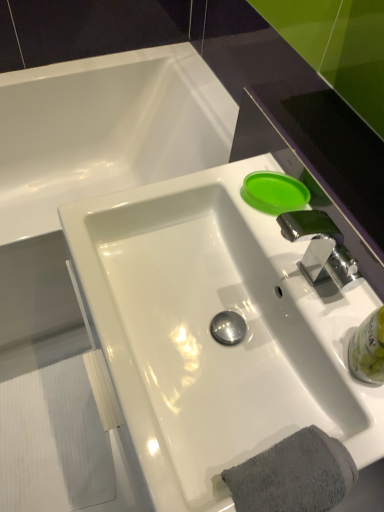
Question: In terms of height, does gray cotton towel at lower right look taller or shorter compared to clear plastic bottle at lower right, which is the second liquid in top-to-bottom order?

Choices:
 (A) short
 (B) tall

Answer: (B)

Question: In terms of size, does gray cotton towel at lower right appear bigger or smaller than clear plastic bottle at lower right, the 1th liquid positioned from the bottom?

Choices:
 (A) big
 (B) small

Answer: (A)

Question: Estimate the real-world distances between objects in this image. Which object is closer to the white glossy bathtub at upper left?

Choices:
 (A) clear plastic bottle at lower right, the 1th liquid from the right
 (B) white glossy sink at center
 (C) gray cotton towel at lower right
 (D) green matte lid at upper right, the 2th liquid positioned from the front

Answer: (B)

Question: Which of these objects is positioned closest to the white glossy sink at center?

Choices:
 (A) green matte lid at upper right, the first liquid in the left-to-right sequence
 (B) clear plastic bottle at lower right, the second liquid positioned from the back
 (C) gray cotton towel at lower right
 (D) white glossy bathtub at upper left

Answer: (C)